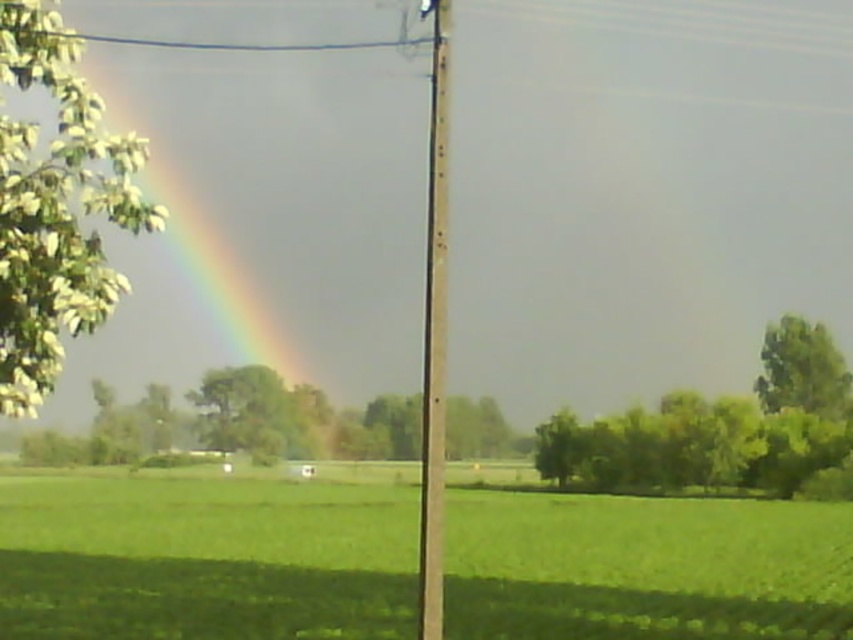
Is green grassy field at center bigger than green leafy tree at left?

Yes, green grassy field at center is bigger than green leafy tree at left.

Does point (502, 584) come farther from viewer compared to point (27, 228)?

That is True.

Image resolution: width=853 pixels, height=640 pixels. Find the location of `green grassy field at center`. green grassy field at center is located at coordinates (204, 556).

Does point (28, 321) lie behind point (445, 38)?

No, (28, 321) is in front of (445, 38).

Who is higher up, green leafy tree at left or smooth wooden pole at center?

green leafy tree at left

Is point (26, 179) behind point (436, 550)?

No, it is not.

Where is `green leafy tree at left`? The height and width of the screenshot is (640, 853). green leafy tree at left is located at coordinates click(55, 208).

Measure the distance between smooth wooden pole at center and green leafy tree at right.

A distance of 226.77 feet exists between smooth wooden pole at center and green leafy tree at right.

Does point (433, 339) come closer to viewer compared to point (763, 401)?

Yes, point (433, 339) is in front of point (763, 401).

Image resolution: width=853 pixels, height=640 pixels. In order to click on smooth wooden pole at center in this screenshot , I will do `click(434, 337)`.